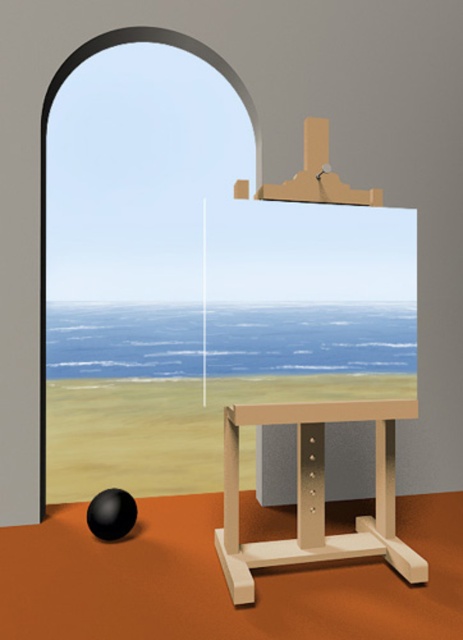
You are standing in the room and want to place a new painting on the wall directly behind the wooden easel at center. Given the easel is at point 0.773, 0.680, where should you mark the spot on the wall to ensure it aligns perfectly with the easel?

The wooden easel at center is positioned at coordinates (314,493), so you should mark the spot on the wall at the same coordinates to align it perfectly with the easel.

You are an interior designer assessing the placement of the smooth glass arch at upper left. Based on its coordinates at point 0.256, 0.099, how does its position compare to the center of the image?

The smooth glass arch at upper left is positioned at coordinates (45, 163), which places it closer to the upper left corner of the image rather than the center.

You are an artist standing in front of the wooden easel at center and the smooth glass arch at upper left. You want to place a small stool between them. Which object should the stool be closer to if it needs to be placed closer to the nearer object?

The wooden easel at center is closer to the viewer than the smooth glass arch at upper left, so the stool should be placed closer to the wooden easel at center.